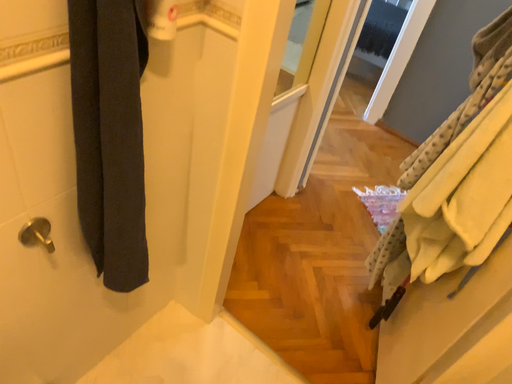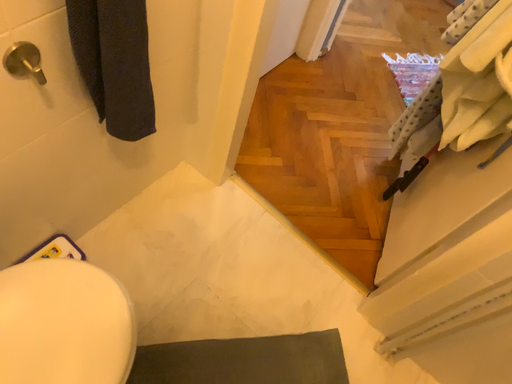
Question: Which way did the camera rotate in the video?

Choices:
 (A) rotated upward
 (B) rotated downward

Answer: (B)